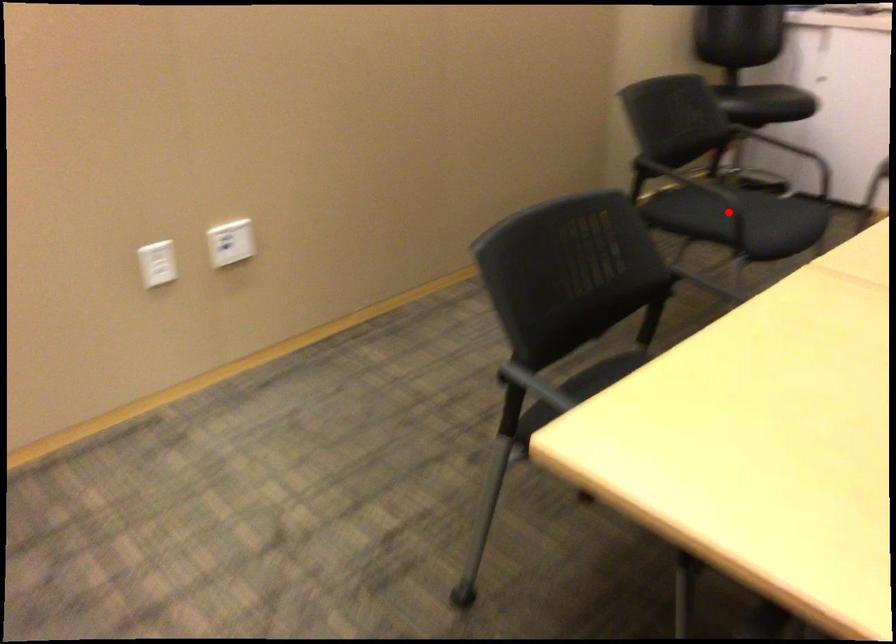
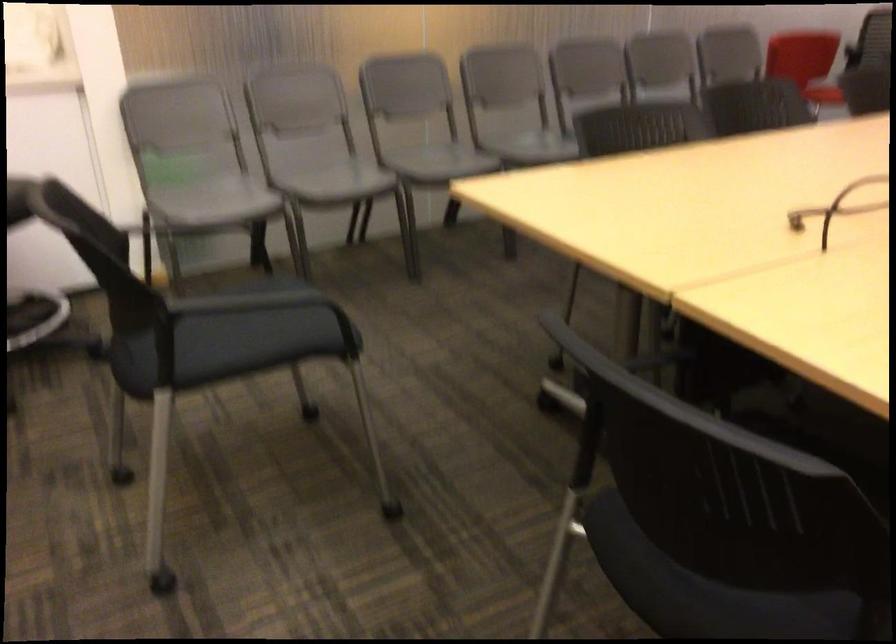
Question: A red point is marked in image1. In image2, is the corresponding 3D point closer to the camera or farther? Reply with the corresponding letter.

Choices:
 (A) The corresponding 3D point is closer.
 (B) The corresponding 3D point is farther.

Answer: (A)